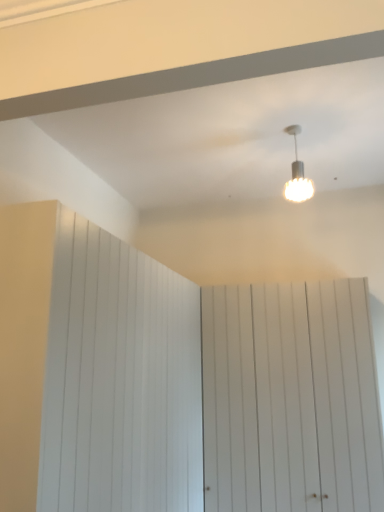
Identify the location of white textured lamp at upper center. (297, 174).

Locate an element on the screen. white wood barn door at center, the first barn door in the right-to-left sequence is located at coordinates (290, 399).

What do you see at coordinates (290, 399) in the screenshot? This screenshot has width=384, height=512. I see `white wood barn door at center, the first barn door in the right-to-left sequence` at bounding box center [290, 399].

Find the location of a particular element. white wood barn door at left, which appears as the 1th barn door when viewed from the left is located at coordinates (119, 380).

Who is shorter, white wood barn door at left, which appears as the 1th barn door when viewed from the left, or white textured lamp at upper center?

white textured lamp at upper center is shorter.

Is point (114, 452) farther from camera compared to point (307, 184)?

No, it is not.

Is white wood barn door at left, which appears as the second barn door when viewed from the right, facing towards white textured lamp at upper center?

No, white wood barn door at left, which appears as the second barn door when viewed from the right, is not aimed at white textured lamp at upper center.

Based on the photo, considering the positions of objects white wood barn door at left, which appears as the 1th barn door when viewed from the left, and white textured lamp at upper center in the image provided, who is behind, white wood barn door at left, which appears as the 1th barn door when viewed from the left, or white textured lamp at upper center?

white textured lamp at upper center is behind.

Is the position of white textured lamp at upper center less distant than that of white wood barn door at center, acting as the 2th barn door starting from the left?

Yes, it is.

Which object is positioned more to the left, white textured lamp at upper center or white wood barn door at center, acting as the 2th barn door starting from the left?

white textured lamp at upper center.

Considering the sizes of objects white textured lamp at upper center and white wood barn door at center, the first barn door in the right-to-left sequence, in the image provided, who is bigger, white textured lamp at upper center or white wood barn door at center, the first barn door in the right-to-left sequence,?

white wood barn door at center, the first barn door in the right-to-left sequence, is bigger.

Who is bigger, white wood barn door at left, which appears as the 1th barn door when viewed from the left, or white wood barn door at center, the first barn door in the right-to-left sequence?

white wood barn door at left, which appears as the 1th barn door when viewed from the left.

Choose the correct answer: Is white wood barn door at left, which appears as the 1th barn door when viewed from the left, inside white wood barn door at center, acting as the 2th barn door starting from the left, or outside it?

white wood barn door at left, which appears as the 1th barn door when viewed from the left, is spatially situated outside white wood barn door at center, acting as the 2th barn door starting from the left.

Which object is closer to the camera taking this photo, white wood barn door at left, which appears as the 1th barn door when viewed from the left, or white wood barn door at center, acting as the 2th barn door starting from the left?

white wood barn door at left, which appears as the 1th barn door when viewed from the left, is in front.

Is white wood barn door at left, which appears as the 1th barn door when viewed from the left, far away from white wood barn door at center, acting as the 2th barn door starting from the left?

No, white wood barn door at left, which appears as the 1th barn door when viewed from the left, is in close proximity to white wood barn door at center, acting as the 2th barn door starting from the left.

Considering the sizes of white wood barn door at center, the first barn door in the right-to-left sequence, and white wood barn door at left, which appears as the second barn door when viewed from the right, in the image, is white wood barn door at center, the first barn door in the right-to-left sequence, wider or thinner than white wood barn door at left, which appears as the second barn door when viewed from the right,?

Considering their sizes, white wood barn door at center, the first barn door in the right-to-left sequence, looks slimmer than white wood barn door at left, which appears as the second barn door when viewed from the right.

Would you say white wood barn door at center, acting as the 2th barn door starting from the left, is a long distance from white wood barn door at left, which appears as the 1th barn door when viewed from the left?

No, white wood barn door at center, acting as the 2th barn door starting from the left, is in close proximity to white wood barn door at left, which appears as the 1th barn door when viewed from the left.

How distant is white wood barn door at center, the first barn door in the right-to-left sequence, from white wood barn door at left, which appears as the second barn door when viewed from the right?

They are 32.00 inches apart.

From the image's perspective, is white wood barn door at center, the first barn door in the right-to-left sequence, beneath white wood barn door at left, which appears as the second barn door when viewed from the right?

Correct, white wood barn door at center, the first barn door in the right-to-left sequence, appears lower than white wood barn door at left, which appears as the second barn door when viewed from the right, in the image.

Is white textured lamp at upper center next to white wood barn door at left, which appears as the second barn door when viewed from the right, and touching it?

No, white textured lamp at upper center is not next to white wood barn door at left, which appears as the second barn door when viewed from the right.

In the scene shown: Is white textured lamp at upper center facing towards white wood barn door at left, which appears as the 1th barn door when viewed from the left?

No, white textured lamp at upper center is not facing towards white wood barn door at left, which appears as the 1th barn door when viewed from the left.

What's the angular difference between white textured lamp at upper center and white wood barn door at left, which appears as the 1th barn door when viewed from the left,'s facing directions?

The angle between the facing direction of white textured lamp at upper center and the facing direction of white wood barn door at left, which appears as the 1th barn door when viewed from the left, is 94.4 degrees.

From a real-world perspective, is white textured lamp at upper center physically located above or below white wood barn door at left, which appears as the 1th barn door when viewed from the left?

In terms of real-world spatial position, white textured lamp at upper center is above white wood barn door at left, which appears as the 1th barn door when viewed from the left.

Who is smaller, white wood barn door at center, the first barn door in the right-to-left sequence, or white textured lamp at upper center?

With smaller size is white textured lamp at upper center.

In the scene shown: Which is correct: white wood barn door at center, acting as the 2th barn door starting from the left, is inside white textured lamp at upper center, or outside of it?

white wood barn door at center, acting as the 2th barn door starting from the left, is not inside white textured lamp at upper center, it's outside.

From a real-world perspective, is white wood barn door at center, the first barn door in the right-to-left sequence, above or below white textured lamp at upper center?

From a real-world perspective, white wood barn door at center, the first barn door in the right-to-left sequence, is physically below white textured lamp at upper center.

Is white wood barn door at center, acting as the 2th barn door starting from the left, thinner than white textured lamp at upper center?

No.

Where is `barn door on the left of white textured lamp at upper center`? barn door on the left of white textured lamp at upper center is located at coordinates (119, 380).

From a real-world perspective, count 1st barn doors downward from the white textured lamp at upper center and point to it. Please provide its 2D coordinates.

[(290, 399)]

Looking at the image, which one is located further to white textured lamp at upper center, white wood barn door at center, acting as the 2th barn door starting from the left, or white wood barn door at left, which appears as the second barn door when viewed from the right?

Based on the image, white wood barn door at left, which appears as the second barn door when viewed from the right, appears to be further to white textured lamp at upper center.

Based on their spatial positions, is white wood barn door at left, which appears as the 1th barn door when viewed from the left, or white wood barn door at center, acting as the 2th barn door starting from the left, further from white textured lamp at upper center?

white wood barn door at left, which appears as the 1th barn door when viewed from the left, lies further to white textured lamp at upper center than the other object.

Looking at the image, which one is located further to white wood barn door at left, which appears as the second barn door when viewed from the right, white wood barn door at center, acting as the 2th barn door starting from the left, or white textured lamp at upper center?

white textured lamp at upper center lies further to white wood barn door at left, which appears as the second barn door when viewed from the right, than the other object.

Which object lies further to the anchor point white wood barn door at left, which appears as the second barn door when viewed from the right, white textured lamp at upper center or white wood barn door at center, the first barn door in the right-to-left sequence?

white textured lamp at upper center.

Which object lies further to the anchor point white wood barn door at center, the first barn door in the right-to-left sequence, white textured lamp at upper center or white wood barn door at left, which appears as the second barn door when viewed from the right?

The object further to white wood barn door at center, the first barn door in the right-to-left sequence, is white textured lamp at upper center.

From the image, which object appears to be nearer to white wood barn door at center, the first barn door in the right-to-left sequence, white wood barn door at left, which appears as the 1th barn door when viewed from the left, or white textured lamp at upper center?

The object closer to white wood barn door at center, the first barn door in the right-to-left sequence, is white wood barn door at left, which appears as the 1th barn door when viewed from the left.

The width and height of the screenshot is (384, 512). I want to click on barn door that lies between white textured lamp at upper center and white wood barn door at center, acting as the 2th barn door starting from the left, from top to bottom, so click(x=119, y=380).